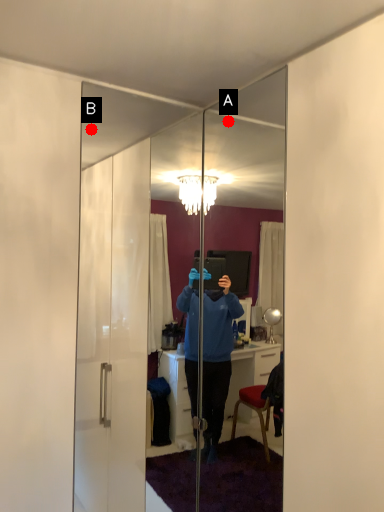
Question: Two points are circled on the image, labeled by A and B beside each circle. Which point is closer to the camera taking this photo?

Choices:
 (A) A is closer
 (B) B is closer

Answer: (A)